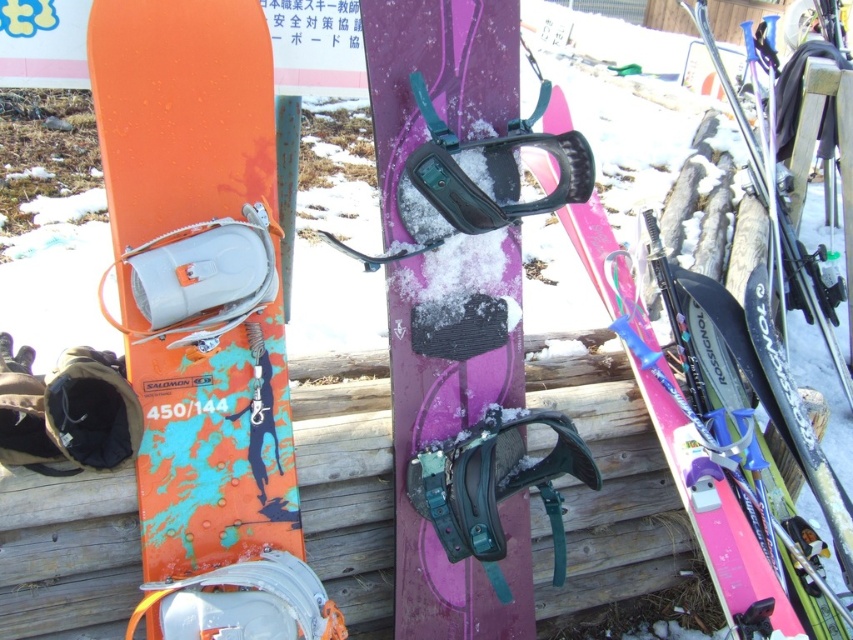
Is point (241, 577) positioned in front of point (746, 564)?

Yes, point (241, 577) is closer to viewer.

Who is more distant from viewer, (202, 408) or (732, 609)?

The point (732, 609) is more distant.

Locate an element on the screen. The height and width of the screenshot is (640, 853). orange matte/splatter snowboard at left is located at coordinates (202, 317).

Between green matte goggles at center and black matte goggles at center, which one has more height?

green matte goggles at center

Is green matte goggles at center thinner than black matte goggles at center?

No, green matte goggles at center is not thinner than black matte goggles at center.

Is point (433, 492) positioned behind point (453, 168)?

Yes, point (433, 492) is farther from viewer.

The image size is (853, 640). What are the coordinates of `green matte goggles at center` in the screenshot? It's located at (498, 483).

Is pink matte snowboard at center closer to the viewer compared to black matte goggles at center?

No, pink matte snowboard at center is behind black matte goggles at center.

Is point (741, 595) farther from viewer compared to point (450, 172)?

That is True.

Locate an element on the screen. This screenshot has width=853, height=640. pink matte snowboard at center is located at coordinates (714, 515).